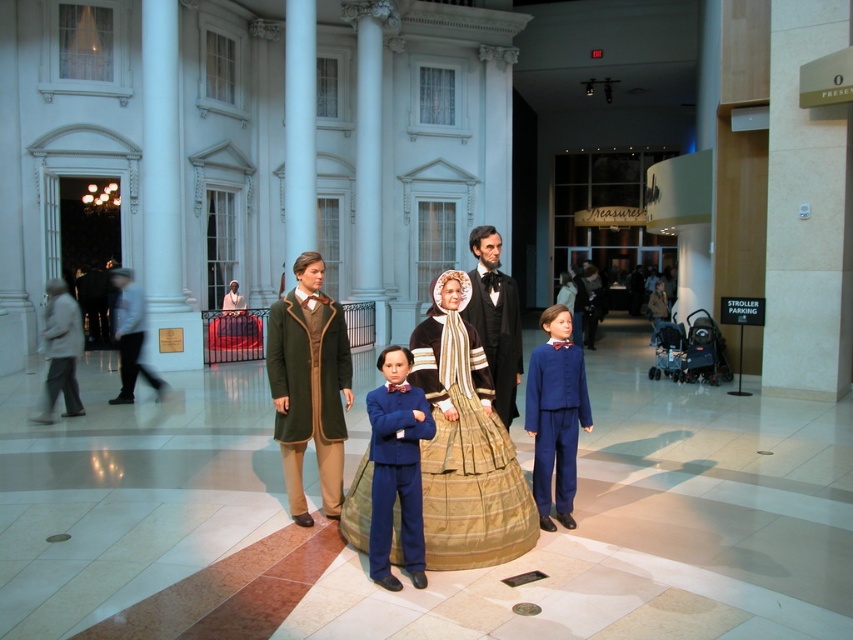
Is point (456, 516) positioned after point (498, 337)?

No, (456, 516) is in front of (498, 337).

Between matte brown suit at center and matte black suit at center, which one appears on the left side from the viewer's perspective?

From the viewer's perspective, matte brown suit at center appears more on the left side.

Who is more forward, (453, 538) or (515, 346)?

Point (453, 538) is in front.

Where is `matte brown suit at center`? This screenshot has width=853, height=640. matte brown suit at center is located at coordinates (465, 444).

Does gold textured dress at center appear on the right side of navy blue fabric business suit at center?

Incorrect, gold textured dress at center is not on the right side of navy blue fabric business suit at center.

Identify the location of gold textured dress at center. The width and height of the screenshot is (853, 640). (468, 465).

You are a GUI agent. You are given a task and a screenshot of the screen. Output one action in this format:
    pyautogui.click(x=<x>, y=<y>)
    Task: Click on the gold textured dress at center
    The image size is (853, 640).
    Given the screenshot: What is the action you would take?
    pyautogui.click(x=468, y=465)

Does gold textured dress at center appear under matte black suit at center?

Correct, gold textured dress at center is located below matte black suit at center.

This screenshot has width=853, height=640. What do you see at coordinates (468, 465) in the screenshot?
I see `gold textured dress at center` at bounding box center [468, 465].

Does point (454, 422) come farther from viewer compared to point (479, 288)?

No, (454, 422) is closer to viewer.

At what (x,y) coordinates should I click in order to perform the action: click on gold textured dress at center. Please return your answer as a coordinate pair (x, y). Image resolution: width=853 pixels, height=640 pixels. Looking at the image, I should click on (468, 465).